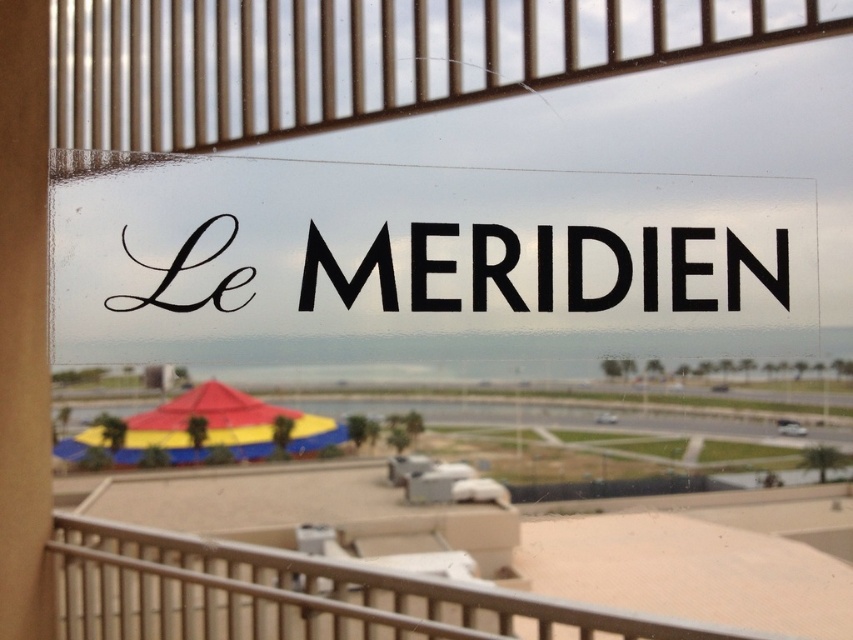
You are trying to determine if you can place a small potted plant between the metallic silver balustrade at center and the multicolored fabric umbrella at lower left. Based on their widths, will there be enough space?

The metallic silver balustrade at center might be wider than the multicolored fabric umbrella at lower left, so there may not be enough space to place a small potted plant between them.

You are standing in a coastal resort and looking through a window. You see a black glossy sign at center and a multicolored fabric umbrella at lower left. Which object is positioned to the right side when viewed from your perspective?

The black glossy sign at center is positioned to the right of the multicolored fabric umbrella at lower left.

You are standing in a coastal resort and looking through a window. You see two points marked on the window glass. The first point is at coordinate point (67, 550) and the second is at point (146, 445). If you were to touch both points on the glass, which point would you touch first when moving from the window edge towards the center?

Point (67, 550) is in front of point (146, 445), so you would touch point (67, 550) first when moving from the window edge towards the center.